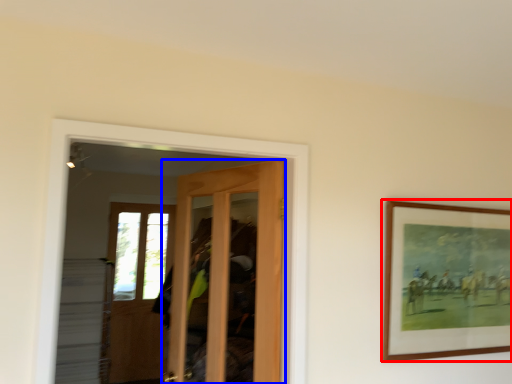
Question: Which of the following is the closest to the observer, picture frame (highlighted by a red box) or door (highlighted by a blue box)?

Choices:
 (A) picture frame
 (B) door

Answer: (B)